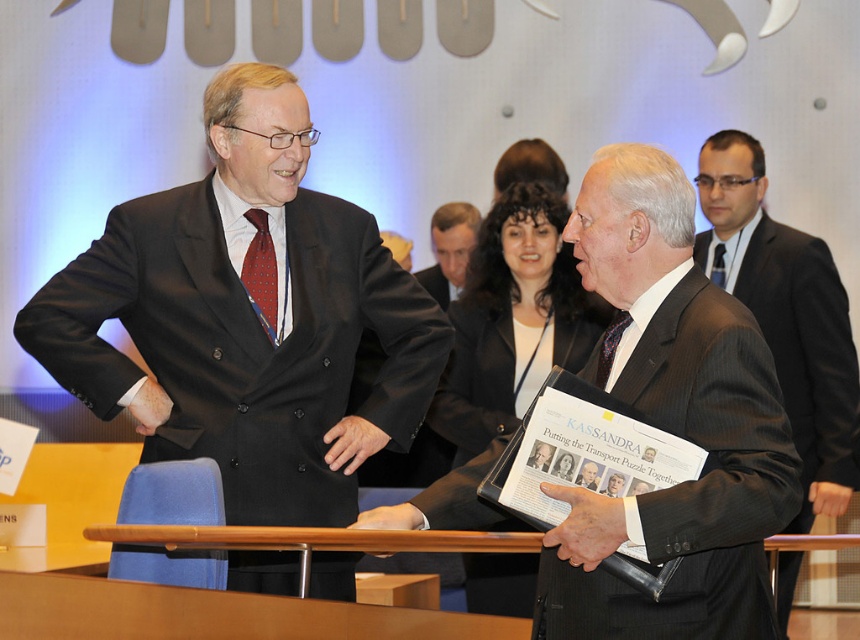
In the scene shown: Which of these two, smooth skin hand at center or maroon silk tie at left, stands taller?

maroon silk tie at left is taller.

Can you confirm if smooth skin hand at center is shorter than maroon silk tie at left?

Correct, smooth skin hand at center is not as tall as maroon silk tie at left.

The height and width of the screenshot is (640, 860). In order to click on smooth skin hand at center in this screenshot , I will do `click(585, 525)`.

Is dark gray textured suit at center below smooth skin hand at center?

No, dark gray textured suit at center is not below smooth skin hand at center.

Can you confirm if dark gray textured suit at center is taller than smooth skin hand at center?

Yes.

Find the location of a particular element. The image size is (860, 640). dark gray textured suit at center is located at coordinates (693, 483).

Is dark gray textured suit at center bigger than black smooth hand at center?

Correct, dark gray textured suit at center is larger in size than black smooth hand at center.

Between dark gray textured suit at center and black smooth hand at center, which one has more height?

dark gray textured suit at center

Image resolution: width=860 pixels, height=640 pixels. What are the coordinates of `dark gray textured suit at center` in the screenshot? It's located at (693, 483).